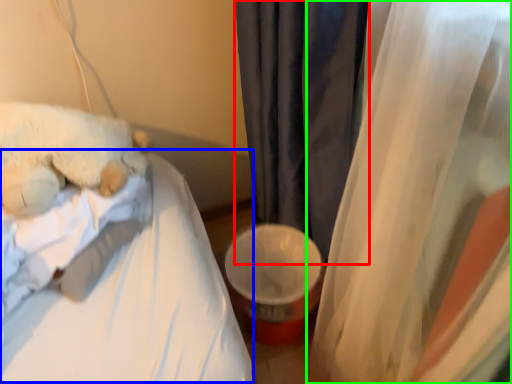
Question: Which object is the closest to the curtain (highlighted by a red box)? Choose among these: mattress (highlighted by a blue box) or curtain (highlighted by a green box).

Choices:
 (A) mattress
 (B) curtain

Answer: (B)